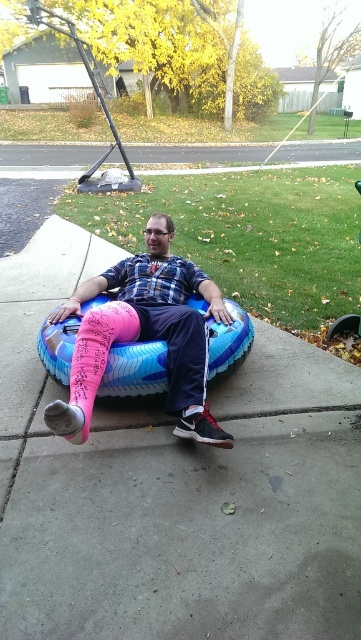
Question: Considering the relative positions of pink matte prosthetic leg at lower left and pink fabric bean bag chair at center in the image provided, where is pink matte prosthetic leg at lower left located with respect to pink fabric bean bag chair at center?

Choices:
 (A) right
 (B) left

Answer: (B)

Question: Which point appears farthest from the camera in this image?

Choices:
 (A) (358, 333)
 (B) (127, 515)

Answer: (A)

Question: Is blue rubber tube at center below pink matte prosthetic leg at lower left?

Choices:
 (A) yes
 (B) no

Answer: (A)

Question: Is the position of blue rubber tube at center less distant than that of pink matte prosthetic leg at lower left?

Choices:
 (A) no
 (B) yes

Answer: (B)

Question: Estimate the real-world distances between objects in this image. Which object is farther from the green fabric bean bag chair at right?

Choices:
 (A) blue rubber tube at center
 (B) pink matte prosthetic leg at lower left
 (C) pink fabric bean bag chair at center

Answer: (A)

Question: Which of these objects is positioned closest to the blue rubber tube at center?

Choices:
 (A) pink fabric bean bag chair at center
 (B) green fabric bean bag chair at right
 (C) pink matte prosthetic leg at lower left

Answer: (A)